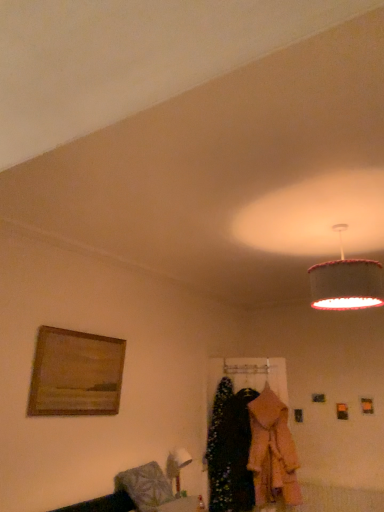
Question: Which direction should I rotate to look at velvet black dress at center, which is the 1th clothing from left to right?

Choices:
 (A) left
 (B) right

Answer: (B)

Question: Is light pink fabric coat at center, placed as the second clothing when sorted from left to right, a part of wooden framed painting at left?

Choices:
 (A) no
 (B) yes

Answer: (A)

Question: From the image's perspective, would you say wooden framed painting at left is shown under light pink fabric coat at center, placed as the second clothing when sorted from left to right?

Choices:
 (A) yes
 (B) no

Answer: (B)

Question: Is wooden framed painting at left completely or partially outside of light pink fabric coat at center, which is the 1th clothing in right-to-left order?

Choices:
 (A) no
 (B) yes

Answer: (B)

Question: Is wooden framed painting at left at the left side of light pink fabric coat at center, placed as the second clothing when sorted from left to right?

Choices:
 (A) no
 (B) yes

Answer: (B)

Question: Is wooden framed painting at left oriented towards light pink fabric coat at center, which is the 1th clothing in right-to-left order?

Choices:
 (A) yes
 (B) no

Answer: (B)

Question: Is wooden framed painting at left positioned before light pink fabric coat at center, which is the 1th clothing in right-to-left order?

Choices:
 (A) yes
 (B) no

Answer: (A)

Question: Are light pink fabric coat at center, which is the 1th clothing in right-to-left order, and wooden framed painting at left making contact?

Choices:
 (A) no
 (B) yes

Answer: (A)

Question: Does light pink fabric coat at center, which is the 1th clothing in right-to-left order, have a lesser height compared to wooden framed painting at left?

Choices:
 (A) no
 (B) yes

Answer: (A)

Question: Would you say light pink fabric coat at center, placed as the second clothing when sorted from left to right, contains wooden framed painting at left?

Choices:
 (A) yes
 (B) no

Answer: (B)

Question: Is light pink fabric coat at center, which is the 1th clothing in right-to-left order, at the left side of wooden framed painting at left?

Choices:
 (A) yes
 (B) no

Answer: (B)

Question: Does light pink fabric coat at center, placed as the second clothing when sorted from left to right, lie behind wooden framed painting at left?

Choices:
 (A) yes
 (B) no

Answer: (A)

Question: Does light pink fabric coat at center, which is the 1th clothing in right-to-left order, have a greater width compared to wooden framed painting at left?

Choices:
 (A) yes
 (B) no

Answer: (A)

Question: Is velvet black dress at center, which is the 1th clothing from left to right, facing towards wooden framed painting at left?

Choices:
 (A) yes
 (B) no

Answer: (B)